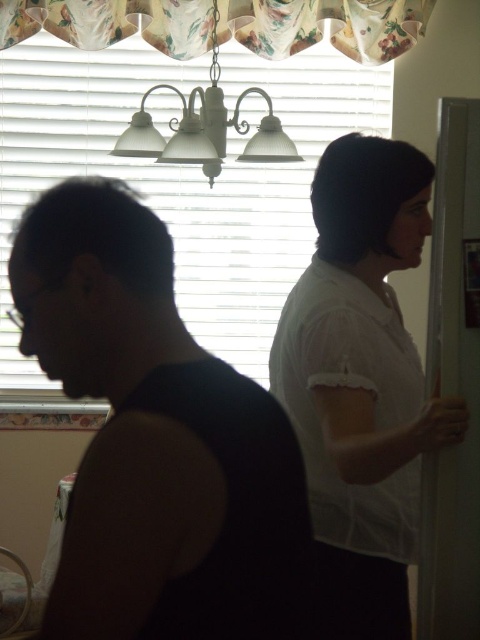
Question: Is white matte blinds at upper center positioned behind white textured lamp at upper center?

Choices:
 (A) yes
 (B) no

Answer: (A)

Question: Is white matte blinds at upper center below white sheer blouse at right?

Choices:
 (A) no
 (B) yes

Answer: (A)

Question: Which object appears farthest from the camera in this image?

Choices:
 (A) black matte shirt at left
 (B) white matte blinds at upper center
 (C) white textured lamp at upper center
 (D) floral fabric valance at upper center

Answer: (B)

Question: Estimate the real-world distances between objects in this image. Which object is closer to the floral fabric valance at upper center?

Choices:
 (A) black matte shirt at left
 (B) white sheer blouse at right
 (C) white matte blinds at upper center
 (D) white textured lamp at upper center

Answer: (D)

Question: Which point is closer to the camera taking this photo?

Choices:
 (A) (190, 205)
 (B) (215, 102)

Answer: (B)

Question: Is white sheer blouse at right above floral fabric valance at upper center?

Choices:
 (A) yes
 (B) no

Answer: (B)